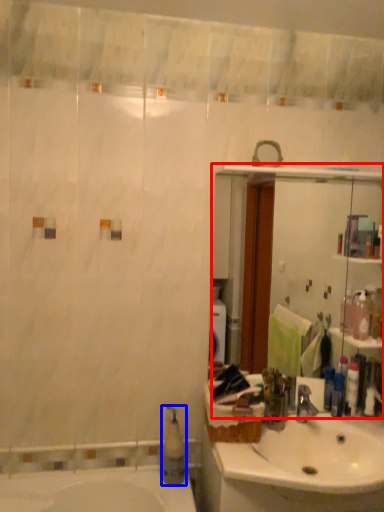
Question: Which object appears farthest to the camera in this image, mirror (highlighted by a red box) or soap dispenser (highlighted by a blue box)?

Choices:
 (A) mirror
 (B) soap dispenser

Answer: (A)